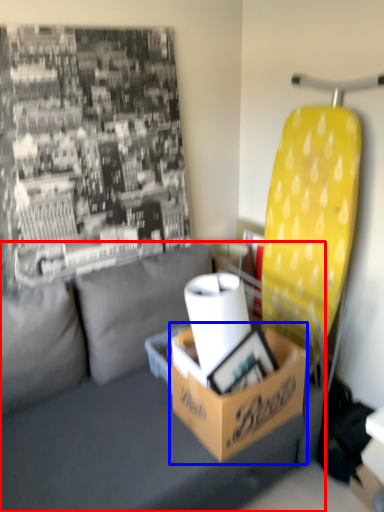
Question: Which of the following is the closest to the observer, studio couch (highlighted by a red box) or box (highlighted by a blue box)?

Choices:
 (A) studio couch
 (B) box

Answer: (A)